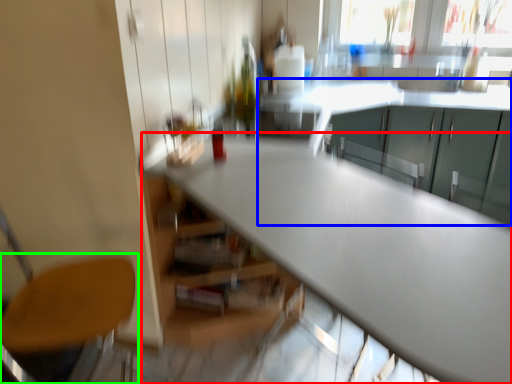
Question: Considering the real-world distances, which object is farthest from table (highlighted by a red box)? cabinetry (highlighted by a blue box) or chair (highlighted by a green box)?

Choices:
 (A) cabinetry
 (B) chair

Answer: (A)